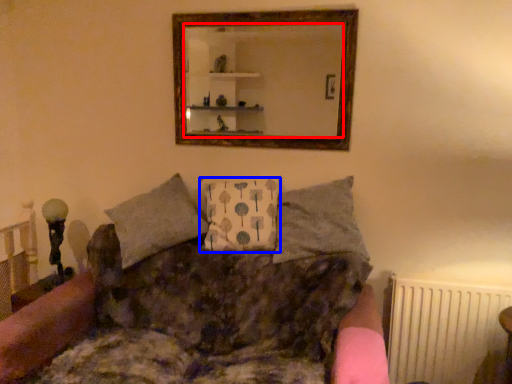
Question: Which of the following is the closest to the observer, mirror (highlighted by a red box) or pillow (highlighted by a blue box)?

Choices:
 (A) mirror
 (B) pillow

Answer: (B)